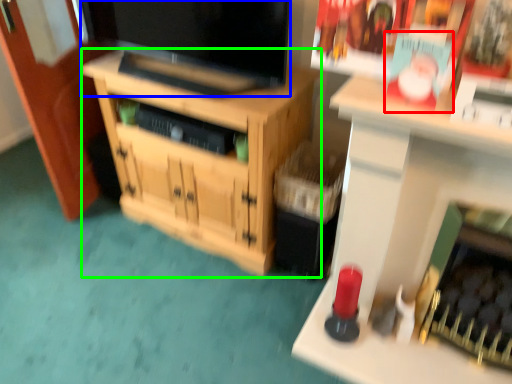
Question: Which object is positioned farthest from magazine (highlighted by a red box)? Select from television (highlighted by a blue box) and cabinetry (highlighted by a green box).

Choices:
 (A) television
 (B) cabinetry

Answer: (B)